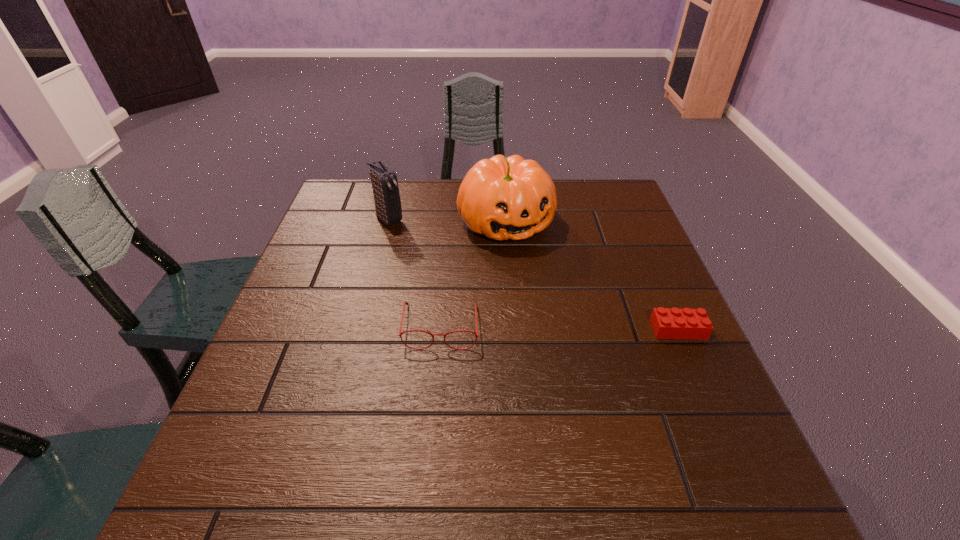
Find the location of a particular element. The height and width of the screenshot is (540, 960). free space located on the carved face of the pumpkin is located at coordinates (575, 323).

In order to click on free space located on the carved face of the pumpkin in this screenshot , I will do point(575,323).

Find the location of a particular element. Image resolution: width=960 pixels, height=540 pixels. free space located 0.220m on the carved face of the pumpkin is located at coordinates (564, 305).

Locate an element on the screen. The image size is (960, 540). clutch bag that is at the far edge is located at coordinates 387,201.

Find the location of a particular element. pumpkin located in the far edge section of the desktop is located at coordinates (502, 198).

Locate an element on the screen. This screenshot has width=960, height=540. object situated at the left edge is located at coordinates (387, 201).

At what (x,y) coordinates should I click in order to perform the action: click on object present at the right edge. Please return your answer as a coordinate pair (x, y). The width and height of the screenshot is (960, 540). Looking at the image, I should click on (667, 323).

What are the coordinates of `object situated at the far left corner` in the screenshot? It's located at (387, 201).

This screenshot has height=540, width=960. I want to click on vacant space at the far edge of the desktop, so click(409, 181).

This screenshot has width=960, height=540. I want to click on free space at the near edge of the desktop, so click(x=414, y=409).